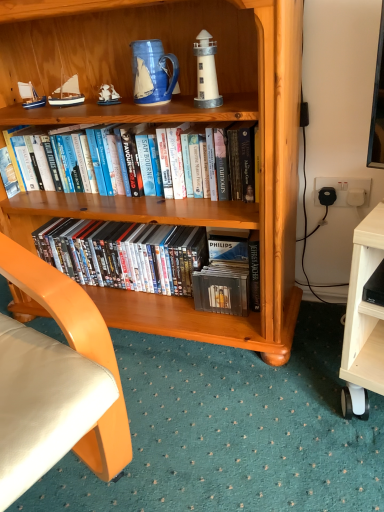
Question: Do you think metallic silver dvds at lower center, which is the second book from top to bottom, is within wooden bookcase at center, or outside of it?

Choices:
 (A) outside
 (B) inside

Answer: (B)

Question: From a real-world perspective, is metallic silver dvds at lower center, marked as the 1th book in a bottom-to-top arrangement, positioned above or below wooden bookcase at center?

Choices:
 (A) above
 (B) below

Answer: (B)

Question: Considering the real-world distances, which object is closest to the white matte lighthouse at upper center?

Choices:
 (A) wooden sailboat at upper left, the 1th sailboat when ordered from right to left
 (B) blue matte sailboat at upper left, acting as the second sailboat starting from the right
 (C) wooden bookcase at center
 (D) white matte ship at upper left
 (E) blue ceramic mug at upper center

Answer: (E)

Question: Which object is the farthest from the blue ceramic mug at upper center?

Choices:
 (A) metallic silver dvds at lower center, which is the second book from top to bottom
 (B) wooden bookcase at center
 (C) white matte lighthouse at upper center
 (D) wooden sailboat at upper left, the 1th sailboat when ordered from right to left
 (E) blue matte sailboat at upper left, which is the first sailboat in left-to-right order

Answer: (A)